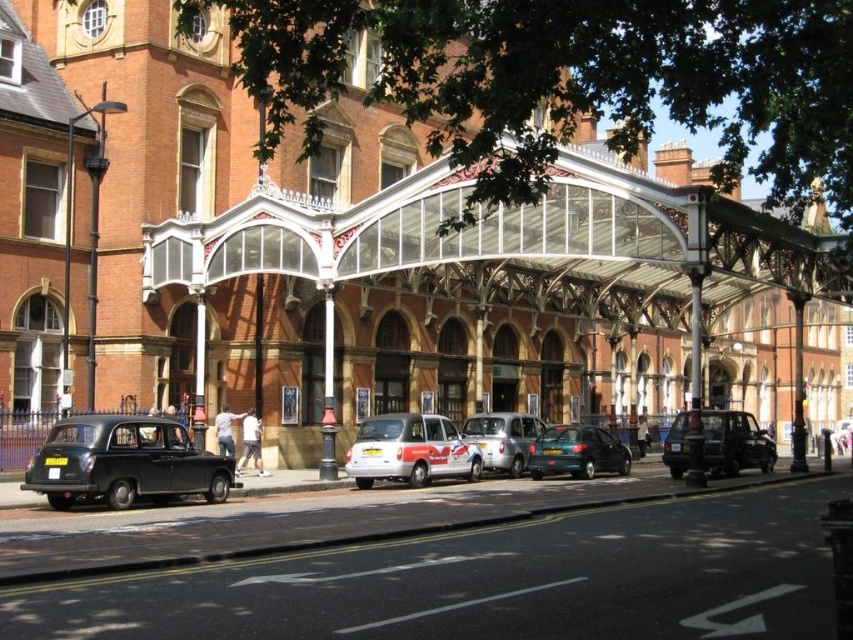
Question: Among these objects, which one is nearest to the camera?

Choices:
 (A) brick railway station at center
 (B) matte black taxi at center
 (C) silver metallic car at center

Answer: (A)

Question: Can you confirm if brick railway station at center is wider than matte black taxi at center?

Choices:
 (A) yes
 (B) no

Answer: (A)

Question: Considering the real-world distances, which object is farthest from the brick railway station at center?

Choices:
 (A) teal glossy hatchback at center
 (B) white glossy taxi at center
 (C) matte black taxi at lower left

Answer: (C)

Question: Among these objects, which one is nearest to the camera?

Choices:
 (A) matte black taxi at lower left
 (B) white glossy taxi at center

Answer: (A)

Question: Is brick railway station at center positioned in front of teal glossy hatchback at center?

Choices:
 (A) no
 (B) yes

Answer: (B)

Question: Is matte black taxi at lower left to the right of silver metallic car at center from the viewer's perspective?

Choices:
 (A) yes
 (B) no

Answer: (B)